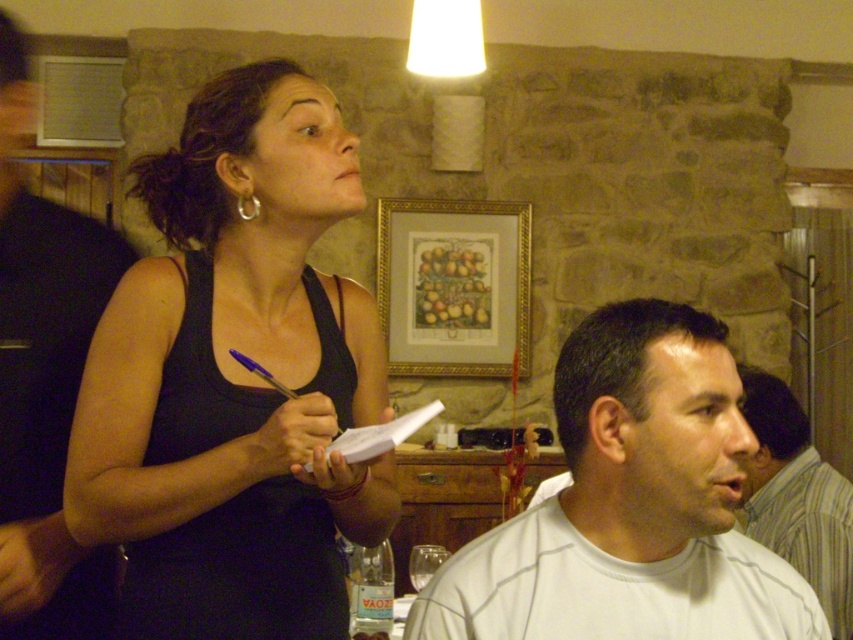
Can you confirm if black fabric tank top at upper left is shorter than white cotton shirt at lower right?

No.

Is black fabric tank top at upper left to the right of white cotton shirt at lower right from the viewer's perspective?

In fact, black fabric tank top at upper left is to the left of white cotton shirt at lower right.

The height and width of the screenshot is (640, 853). What do you see at coordinates (235, 378) in the screenshot?
I see `black fabric tank top at upper left` at bounding box center [235, 378].

Image resolution: width=853 pixels, height=640 pixels. I want to click on black fabric tank top at upper left, so click(235, 378).

Does white matte shirt at upper right have a lesser width compared to gold/gilded picture frame at upper center?

Yes, white matte shirt at upper right is thinner than gold/gilded picture frame at upper center.

Does white matte shirt at upper right appear on the left side of gold/gilded picture frame at upper center?

Indeed, white matte shirt at upper right is positioned on the left side of gold/gilded picture frame at upper center.

What are the coordinates of `white matte shirt at upper right` in the screenshot? It's located at (44, 381).

You are a GUI agent. You are given a task and a screenshot of the screen. Output one action in this format:
    pyautogui.click(x=<x>, y=<y>)
    Task: Click on the white matte shirt at upper right
    This screenshot has height=640, width=853.
    Given the screenshot: What is the action you would take?
    pyautogui.click(x=44, y=381)

You are a GUI agent. You are given a task and a screenshot of the screen. Output one action in this format:
    pyautogui.click(x=<x>, y=<y>)
    Task: Click on the white matte shirt at lower right
    
    Given the screenshot: What is the action you would take?
    (631, 506)